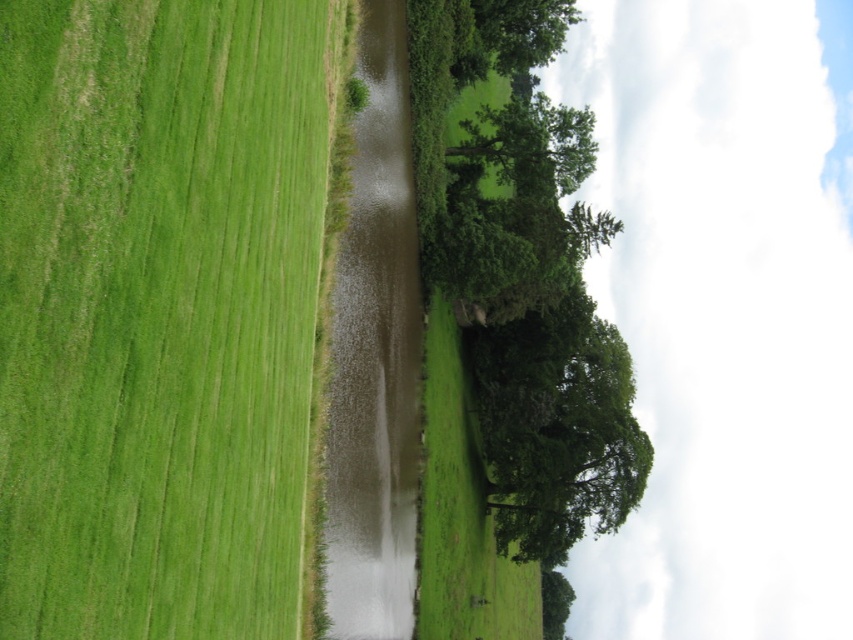
Between point (273, 172) and point (576, 284), which one is positioned behind?

Point (576, 284)

Does point (10, 376) lie behind point (544, 44)?

No.

Is point (138, 342) farther from camera compared to point (577, 353)?

No.

Identify the location of green grass at left. The height and width of the screenshot is (640, 853). (157, 312).

Based on the photo, is green leafy tree at center positioned behind green leafy tree at upper center?

No.

Does green leafy tree at center appear under green leafy tree at upper center?

Correct, green leafy tree at center is located below green leafy tree at upper center.

Is point (593, 433) positioned in front of point (538, 145)?

That is False.

Where is `green leafy tree at center`? green leafy tree at center is located at coordinates (509, 317).

Between green grass at left and green leafy tree at upper center, which one has less height?

green grass at left

Between green grass at left and green leafy tree at upper center, which one is positioned lower?

Positioned lower is green grass at left.

Does point (132, 332) come farther from viewer compared to point (524, 147)?

No, (132, 332) is closer to viewer.

Find the location of a particular element. green grass at left is located at coordinates (157, 312).